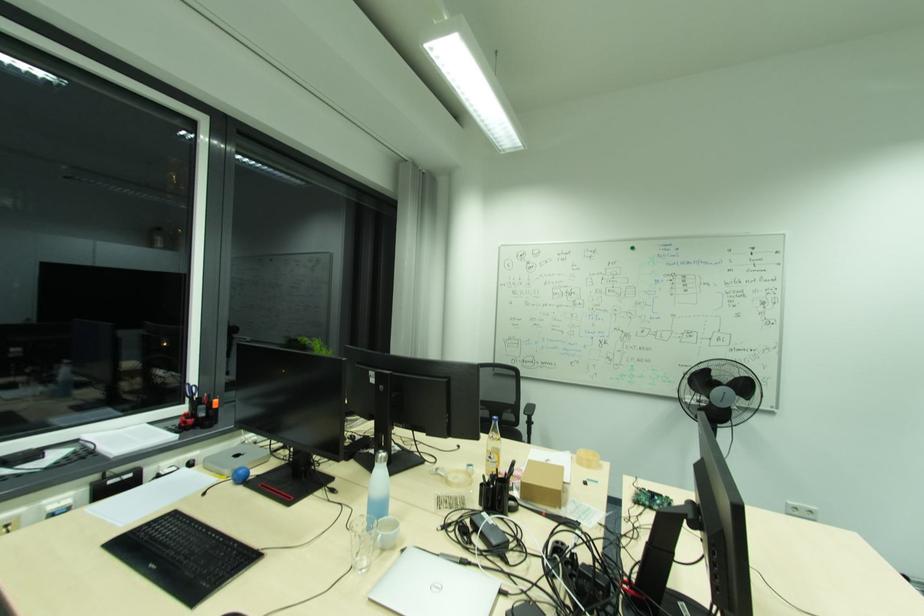
What do you see at coordinates (433, 586) in the screenshot?
I see `the open white book` at bounding box center [433, 586].